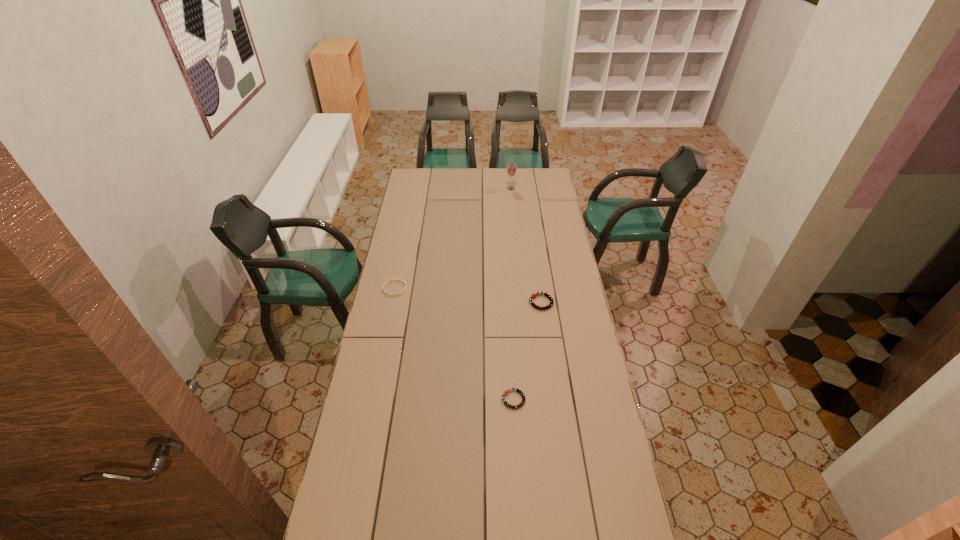
The image size is (960, 540). I want to click on the tallest object, so pyautogui.click(x=511, y=168).

Identify the location of the farthest object. (511, 168).

Locate an element on the screen. the rightmost bracelet is located at coordinates (533, 296).

What are the coordinates of `the leftmost object` in the screenshot? It's located at (386, 282).

What are the coordinates of `the second bracelet from left to right` in the screenshot? It's located at (505, 392).

Locate an element on the screen. Image resolution: width=960 pixels, height=540 pixels. the nearest object is located at coordinates (505, 392).

Image resolution: width=960 pixels, height=540 pixels. Find the location of `free space located 0.090m on the back of the tallest object`. free space located 0.090m on the back of the tallest object is located at coordinates (510, 178).

At what (x,y) coordinates should I click in order to perform the action: click on free space located 0.370m on the back of the rightmost bracelet. Please return your answer as a coordinate pair (x, y). The width and height of the screenshot is (960, 540). Looking at the image, I should click on (533, 244).

Identify the location of free space located on the surface of the leftmost object showing star-shaped elements. This screenshot has width=960, height=540. (391, 309).

Image resolution: width=960 pixels, height=540 pixels. In order to click on free location located on the right of the nearest bracelet in this screenshot , I will do `click(564, 400)`.